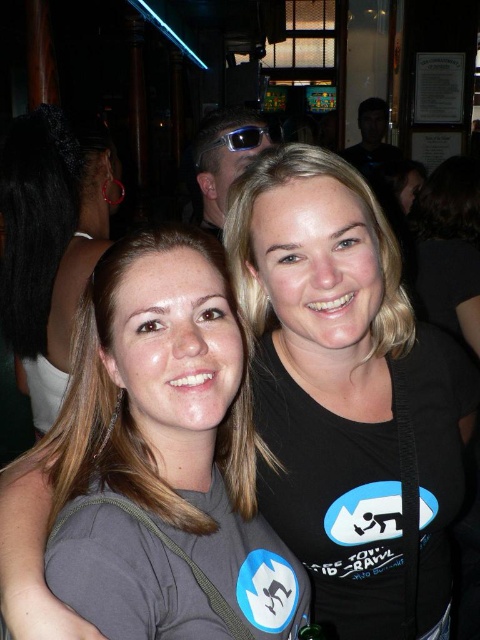
Question: Does black matte shirt at center appear on the right side of matte black sunglasses at upper center?

Choices:
 (A) yes
 (B) no

Answer: (A)

Question: Does matte gray shirt at center lie in front of matte black sunglasses at upper center?

Choices:
 (A) yes
 (B) no

Answer: (A)

Question: Among these points, which one is farthest from the camera?

Choices:
 (A) (372, 515)
 (B) (44, 257)
 (C) (222, 115)
 (D) (217, 147)

Answer: (D)

Question: Does gray matte shirt at center have a greater width compared to matte gray shirt at center?

Choices:
 (A) no
 (B) yes

Answer: (B)

Question: Which object appears closest to the camera in this image?

Choices:
 (A) gray matte shirt at center
 (B) shiny blue plastic goggles at center
 (C) matte black sunglasses at upper center
 (D) matte gray shirt at center

Answer: (A)

Question: Among these objects, which one is farthest from the camera?

Choices:
 (A) shiny blue plastic goggles at center
 (B) matte black sunglasses at upper center
 (C) gray matte shirt at center
 (D) matte gray shirt at center

Answer: (A)